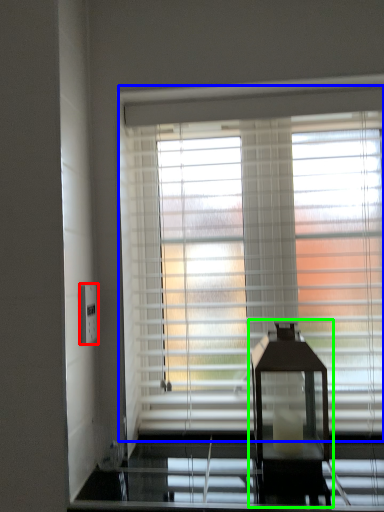
Question: Considering the real-world distances, which object is farthest from electric outlet (highlighted by a red box)? window blind (highlighted by a blue box) or table lamp (highlighted by a green box)?

Choices:
 (A) window blind
 (B) table lamp

Answer: (B)